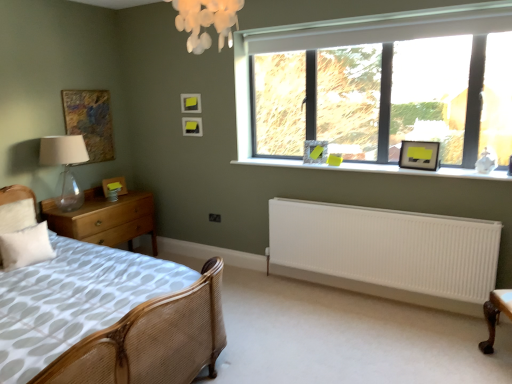
You are a GUI agent. You are given a task and a screenshot of the screen. Output one action in this format:
    pyautogui.click(x=<x>, y=<y>)
    Task: Click on the blank area beneath white ribbed radiator at lower center (from a real-world perspective)
    This screenshot has height=384, width=512.
    Given the screenshot: What is the action you would take?
    pyautogui.click(x=359, y=293)